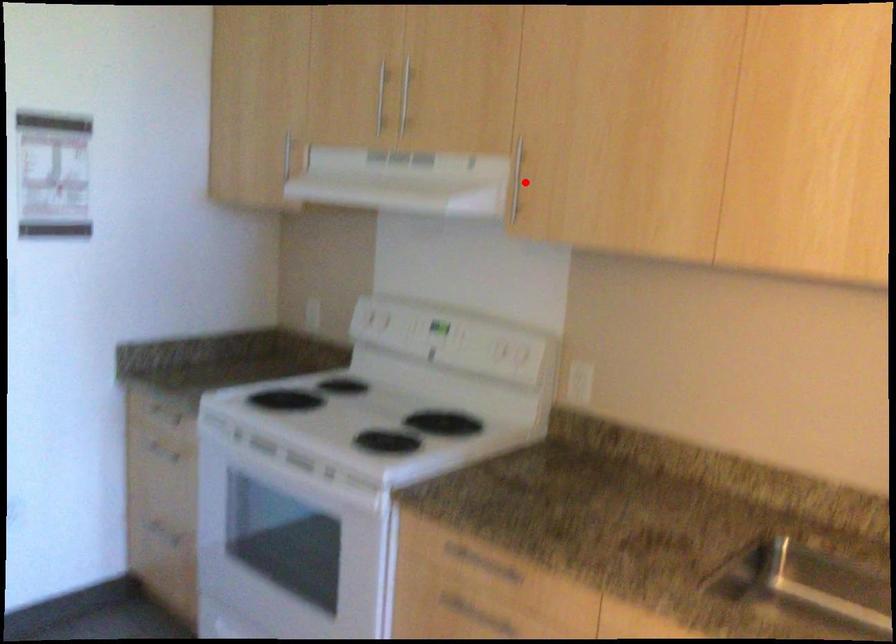
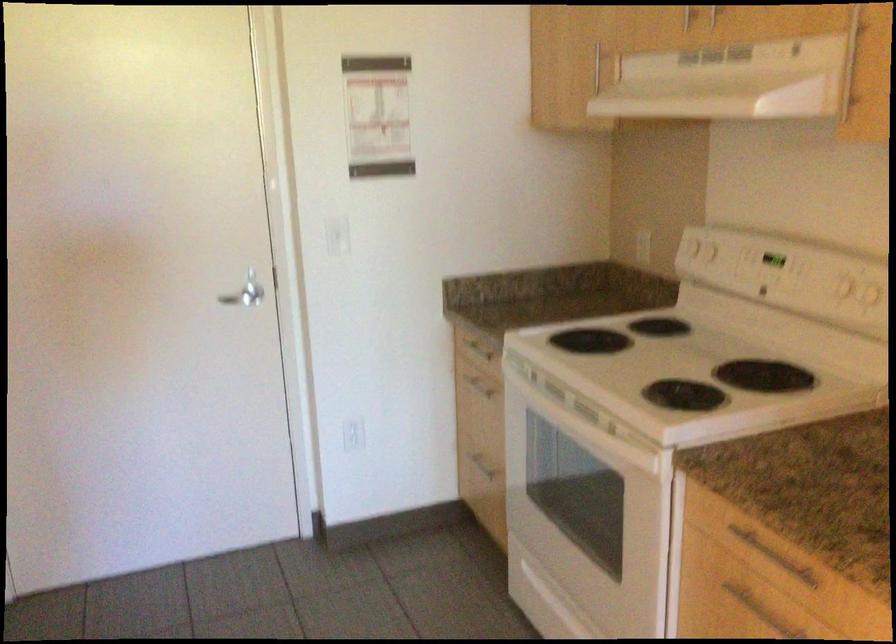
In the second image, find the point that corresponds to the highlighted location in the first image.

(868, 77)